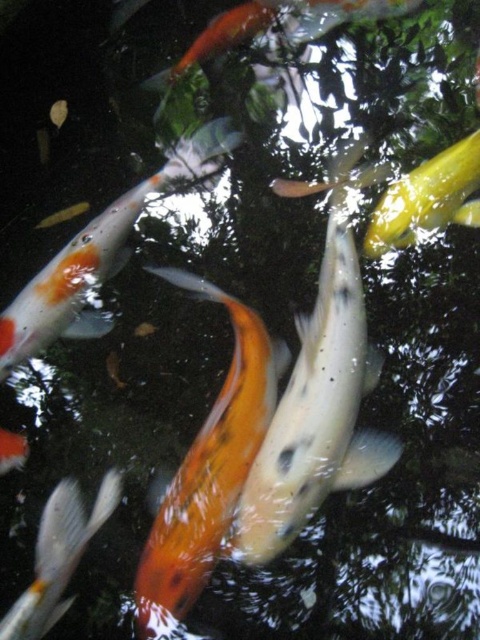
Consider the image. You are a photographer standing at the edge of a pond. You want to take a closeup photo of the speckled white fish at center. If your camera has a maximum focus range of 5 feet, will you be able to capture the fish clearly?

The speckled white fish at center is 4.50 feet away from the camera, which is within the camera maximum focus range of 5 feet. Therefore, you can capture the fish clearly.

You are a photographer trying to capture a photo of the orange and white speckled fish at center and the orange and white speckled fish at lower left. From your current position, which fish is positioned to your right?

The orange and white speckled fish at center is positioned to the right of the orange and white speckled fish at lower left, so the fish to your right would be the orange and white speckled fish at center.